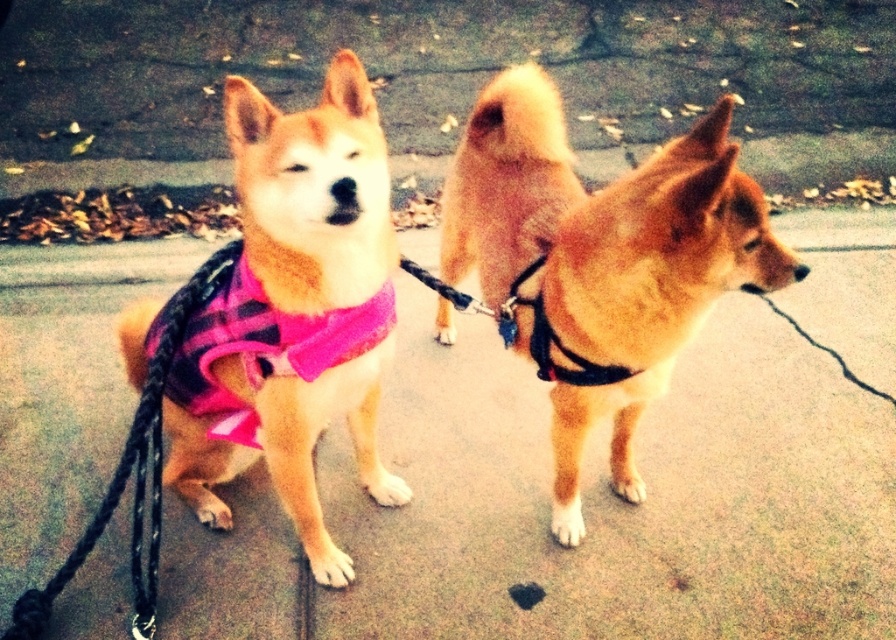
Which of these two, smooth concrete pavement at center or matte pink fabric at center, stands shorter?

matte pink fabric at center is shorter.

Does smooth concrete pavement at center have a greater height compared to matte pink fabric at center?

Yes.

Is point (642, 472) positioned behind point (214, 312)?

That is True.

The height and width of the screenshot is (640, 896). In order to click on smooth concrete pavement at center in this screenshot , I will do `click(642, 476)`.

Does point (619, 227) come closer to viewer compared to point (250, 156)?

That is False.

Does point (613, 225) lie in front of point (369, 166)?

No, it is not.

Locate an element on the screen. This screenshot has height=640, width=896. golden fur dog at center is located at coordinates (600, 260).

Does golden fur dog at center appear on the left side of pink fabric neckband at center?

In fact, golden fur dog at center is to the right of pink fabric neckband at center.

Does golden fur dog at center appear under pink fabric neckband at center?

Actually, golden fur dog at center is above pink fabric neckband at center.

This screenshot has height=640, width=896. Find the location of `golden fur dog at center`. golden fur dog at center is located at coordinates point(600,260).